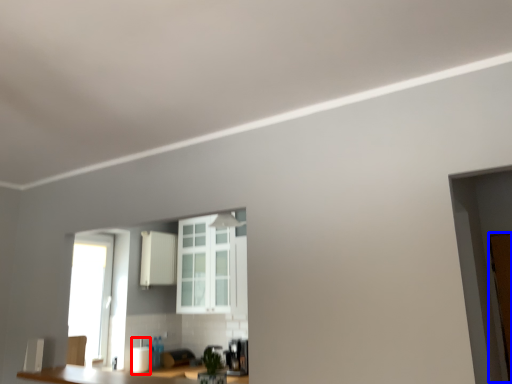
Question: Which object appears farthest to the camera in this image, appliance (highlighted by a red box) or door (highlighted by a blue box)?

Choices:
 (A) appliance
 (B) door

Answer: (A)